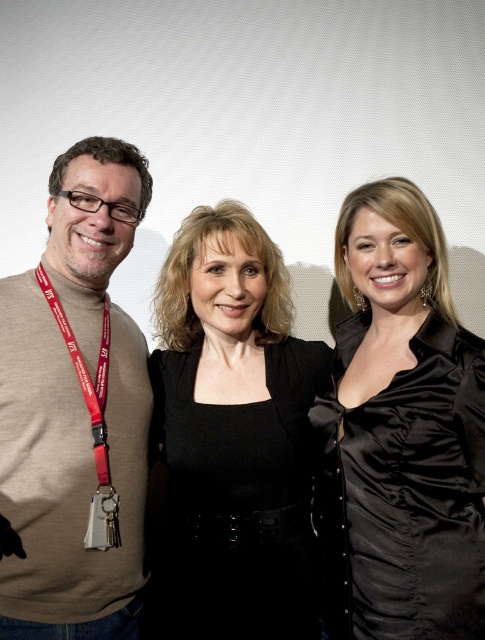
Based on the photo, you are a photographer who needs to adjust the lighting to ensure both the black satin blouse at center and the silver metallic keychain at center are well lit. Which object should you focus on first to avoid glare from the light source?

The silver metallic keychain at center should be focused on first because it is more reflective and prone to glare compared to the black satin blouse at center.

Consider the image. Based on the scene description, can you determine the spatial relationship between the black satin blouse at center and the silver metallic keychain at center?

The black satin blouse at center is above the silver metallic keychain at center.